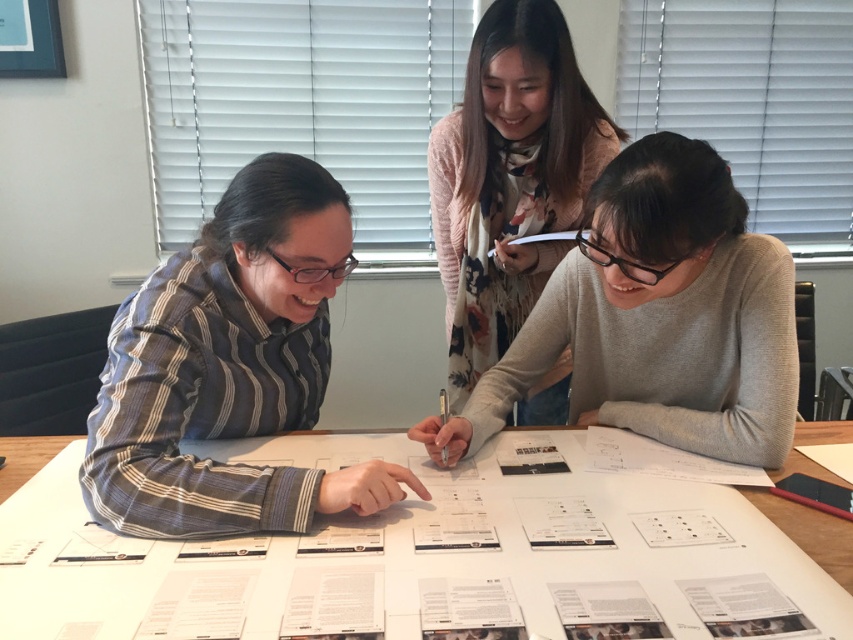
From the picture: You are a participant in the meeting and need to place a folder that is 12 inches wide on the table. Given the white paper at center and the gray matte sweater at center, which object can accommodate the folder without overlapping?

The white paper at center can accommodate the folder since its width surpasses the gray matte sweater at center.

Looking at this image, you are standing in the office and want to pick up the white paper at center and the floral sweater at upper center. Which object will you need to reach further to grab?

The floral sweater at upper center is further away from the viewer than the white paper at center, so you will need to reach further to grab the floral sweater at upper center.

In the scene shown: You are an office assistant who needs to place a new document on the table. The document is the same size as the floral sweater at upper center. Can you fit it on the white paper at center without overlapping?

The white paper at center is smaller than the floral sweater at upper center. Since the new document is the same size as the floral sweater at upper center, it cannot fit on the white paper at center without overlapping.